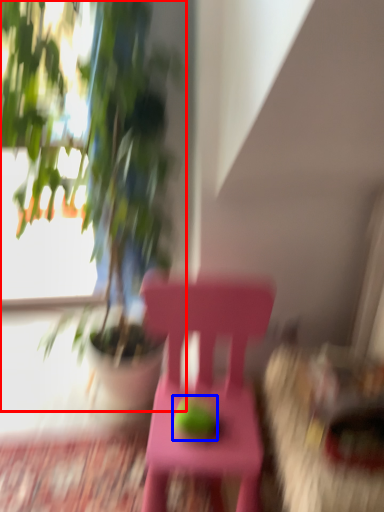
Question: Among these objects, which one is nearest to the camera, houseplant (highlighted by a red box) or fruit (highlighted by a blue box)?

Choices:
 (A) houseplant
 (B) fruit

Answer: (A)